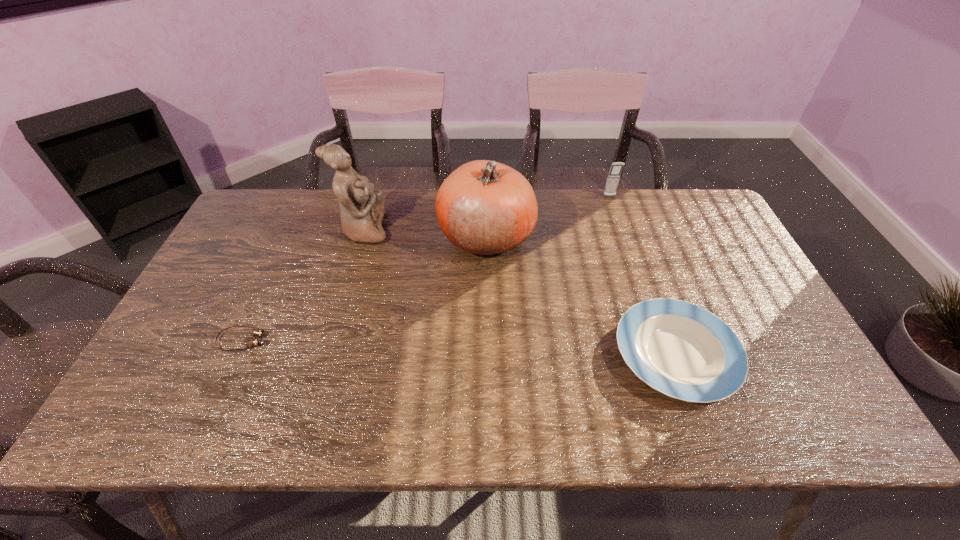
Image resolution: width=960 pixels, height=540 pixels. Find the location of `vacant space located on the back of the plate`. vacant space located on the back of the plate is located at coordinates (647, 275).

This screenshot has width=960, height=540. Find the location of `vacant space located on the front lenses and sides of the goggles`. vacant space located on the front lenses and sides of the goggles is located at coordinates (386, 340).

This screenshot has width=960, height=540. What are the coordinates of `figurine present at the far edge` in the screenshot? It's located at (361, 207).

At what (x,y) coordinates should I click in order to perform the action: click on pumpkin present at the far edge. Please return your answer as a coordinate pair (x, y). Looking at the image, I should click on (484, 207).

Identify the location of cellular telephone positioned at the far edge. (616, 168).

What are the coordinates of `object present at the near edge` in the screenshot? It's located at (682, 350).

This screenshot has height=540, width=960. I want to click on object that is at the left edge, so click(254, 341).

Find the location of a particular element. The width and height of the screenshot is (960, 540). object at the right edge is located at coordinates tap(682, 350).

Find the location of a particular element. Image resolution: width=960 pixels, height=540 pixels. object that is at the near right corner is located at coordinates (682, 350).

You are a GUI agent. You are given a task and a screenshot of the screen. Output one action in this format:
    pyautogui.click(x=<x>, y=<y>)
    Task: Click on the free region at the far edge of the desktop
    This screenshot has width=960, height=540.
    Given the screenshot: What is the action you would take?
    pyautogui.click(x=592, y=209)